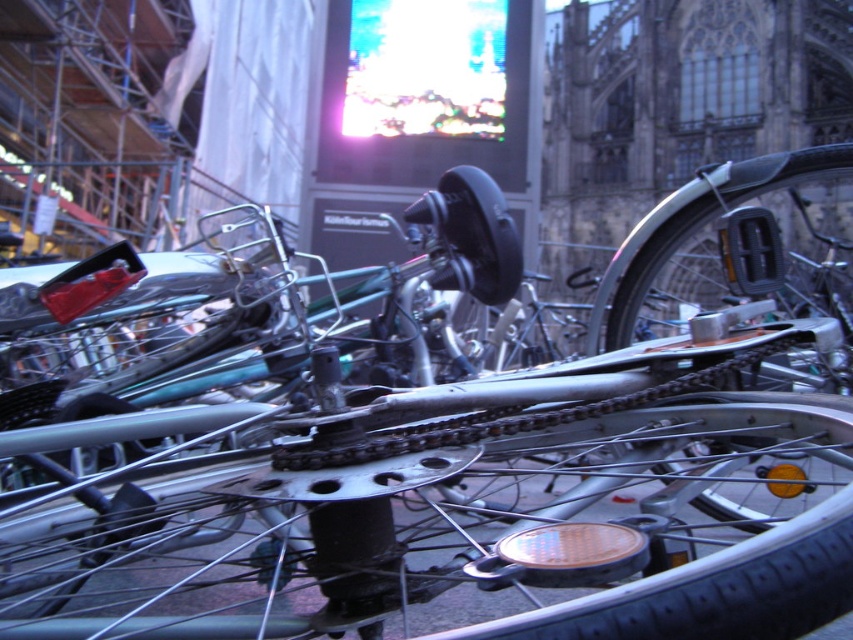
Looking at this image, can you confirm if silver metallic bicycle wheel at center is positioned below shiny metallic chainring at center?

Yes.

Is point (152, 516) farther from viewer compared to point (807, 173)?

That is False.

Find the location of a particular element. The width and height of the screenshot is (853, 640). silver metallic bicycle wheel at center is located at coordinates (440, 516).